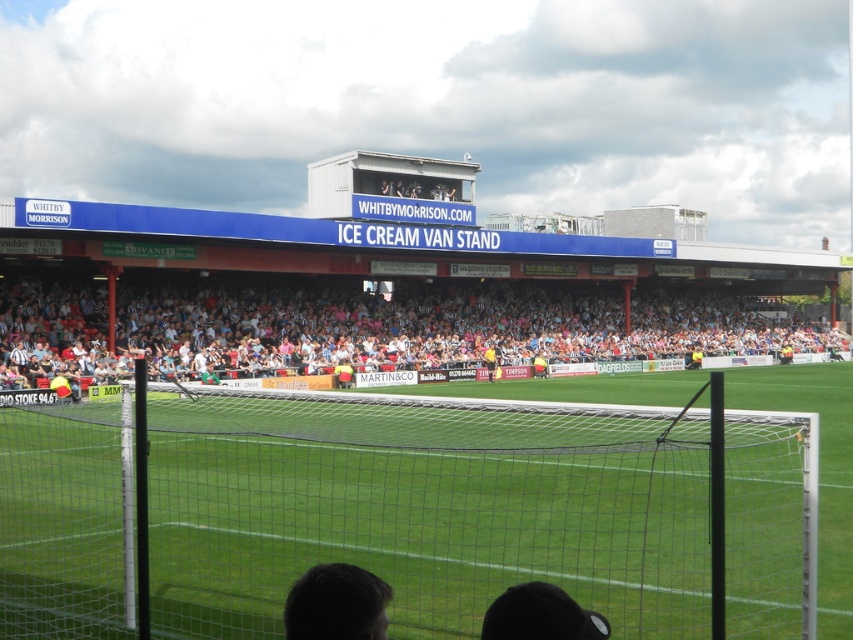
Question: Where is dark brown hair at lower center located in relation to yellow jersey at center in the image?

Choices:
 (A) right
 (B) left

Answer: (B)

Question: Which object is the closest to the dark brown hair at lower center?

Choices:
 (A) white plastic seats at center
 (B) yellow jersey at center
 (C) green netting at center

Answer: (C)

Question: Which point appears farthest from the camera in this image?

Choices:
 (A) (363, 628)
 (B) (553, 339)

Answer: (B)

Question: Is dark brown hair at lower center further to camera compared to yellow jersey at center?

Choices:
 (A) yes
 (B) no

Answer: (B)

Question: Where is white plastic seats at center located in relation to yellow jersey at center in the image?

Choices:
 (A) above
 (B) below

Answer: (A)

Question: Considering the real-world distances, which object is farthest from the yellow jersey at center?

Choices:
 (A) white plastic seats at center
 (B) green netting at center
 (C) dark brown hair at lower center

Answer: (C)